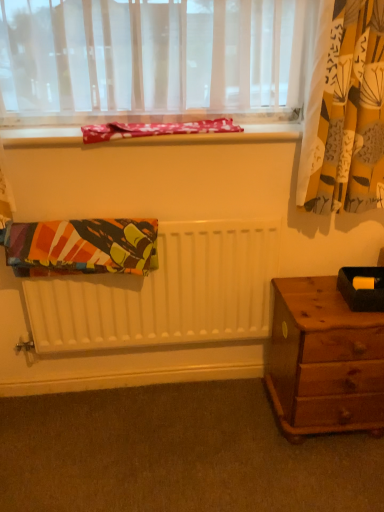
Question: From a real-world perspective, is carpet at lower center positioned over wooden nightstand at lower right based on gravity?

Choices:
 (A) no
 (B) yes

Answer: (A)

Question: Are carpet at lower center and wooden nightstand at lower right far apart?

Choices:
 (A) yes
 (B) no

Answer: (B)

Question: From a real-world perspective, is carpet at lower center physically below wooden nightstand at lower right?

Choices:
 (A) yes
 (B) no

Answer: (A)

Question: Is wooden nightstand at lower right located within carpet at lower center?

Choices:
 (A) yes
 (B) no

Answer: (B)

Question: From the image's perspective, does carpet at lower center appear higher than wooden nightstand at lower right?

Choices:
 (A) no
 (B) yes

Answer: (A)

Question: From the image's perspective, is red floral fabric at upper center, which is the 2th blanket in bottom-to-top order, above or below carpet at lower center?

Choices:
 (A) below
 (B) above

Answer: (B)

Question: From their relative heights in the image, would you say red floral fabric at upper center, which is the 2th blanket in bottom-to-top order, is taller or shorter than carpet at lower center?

Choices:
 (A) short
 (B) tall

Answer: (B)

Question: Is red floral fabric at upper center, the 1th blanket from the top, in front of or behind carpet at lower center in the image?

Choices:
 (A) front
 (B) behind

Answer: (B)

Question: From a real-world perspective, is red floral fabric at upper center, the 1th blanket from the top, positioned above or below carpet at lower center?

Choices:
 (A) above
 (B) below

Answer: (A)

Question: Is black matte box at right in front of or behind matte fabric at upper center in the image?

Choices:
 (A) behind
 (B) front

Answer: (B)

Question: Considering the positions of black matte box at right and matte fabric at upper center in the image, is black matte box at right taller or shorter than matte fabric at upper center?

Choices:
 (A) short
 (B) tall

Answer: (B)

Question: Is point (339, 283) closer or farther from the camera than point (221, 133)?

Choices:
 (A) farther
 (B) closer

Answer: (A)

Question: From a real-world perspective, is black matte box at right positioned above or below matte fabric at upper center?

Choices:
 (A) above
 (B) below

Answer: (B)

Question: From a real-world perspective, relative to red floral fabric at upper center, which is the 2th blanket in bottom-to-top order, is black matte box at right vertically above or below?

Choices:
 (A) above
 (B) below

Answer: (B)

Question: From the image's perspective, relative to red floral fabric at upper center, the 1th blanket from the top, is black matte box at right above or below?

Choices:
 (A) above
 (B) below

Answer: (B)